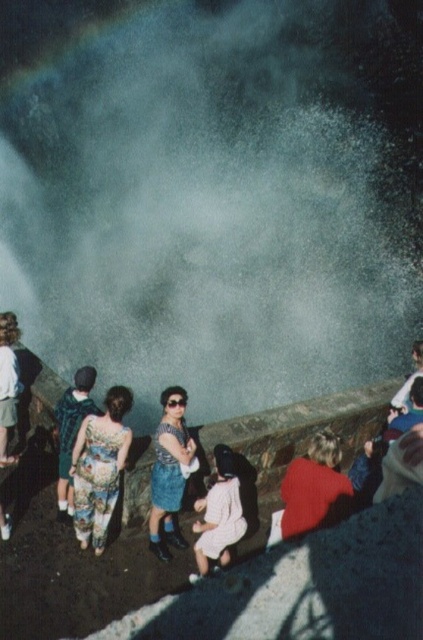
Between point (368, 221) and point (11, 392), which one is positioned in front?

Point (11, 392)

Does white mist at center have a smaller size compared to white cotton shirt at lower left?

Actually, white mist at center might be larger than white cotton shirt at lower left.

Between point (393, 214) and point (2, 356), which one is positioned behind?

The point (393, 214) is behind.

Locate an element on the screen. white mist at center is located at coordinates (214, 192).

Does point (98, 467) lie in front of point (91, 365)?

Yes, it is.

Is floral fabric dress at center above floral fabric dress at lower left?

Incorrect, floral fabric dress at center is not positioned above floral fabric dress at lower left.

Is point (91, 461) more distant than point (73, 410)?

No, (91, 461) is in front of (73, 410).

In order to click on floral fabric dress at center in this screenshot , I will do `click(99, 467)`.

Does white satin dress at center have a greater height compared to floral fabric dress at lower left?

No, white satin dress at center is not taller than floral fabric dress at lower left.

Based on the photo, does white satin dress at center lie in front of floral fabric dress at lower left?

Yes, it is in front of floral fabric dress at lower left.

This screenshot has width=423, height=640. What do you see at coordinates (219, 516) in the screenshot? I see `white satin dress at center` at bounding box center [219, 516].

Identify the location of white satin dress at center. The height and width of the screenshot is (640, 423). (219, 516).